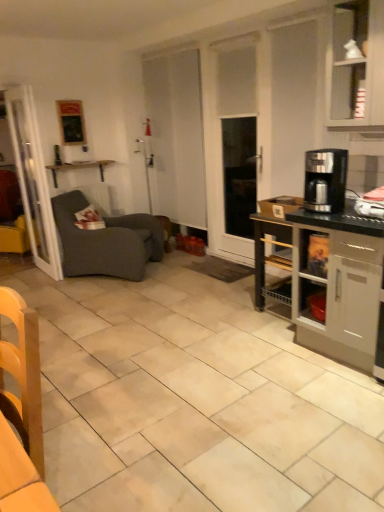
The image size is (384, 512). What do you see at coordinates (331, 282) in the screenshot?
I see `black glossy coffee maker at right` at bounding box center [331, 282].

Where is `white glossy cabinet at upper right`? This screenshot has height=512, width=384. white glossy cabinet at upper right is located at coordinates (356, 65).

What do you see at coordinates (325, 180) in the screenshot? This screenshot has width=384, height=512. I see `satin black coffee maker at right` at bounding box center [325, 180].

The width and height of the screenshot is (384, 512). I want to click on transparent glass door at left, so click(33, 180).

What is the approximate width of wooden chair at lower left?

wooden chair at lower left is 16.15 centimeters in width.

In order to face dark gray fabric studio couch at left, should I rotate leftwards or rightwards?

A 11.307 degree turn to the left will do.

This screenshot has width=384, height=512. In order to click on black glossy coffee maker at right in this screenshot , I will do `click(331, 282)`.

Does dark gray fabric studio couch at left contain wooden chair at lower left?

No, wooden chair at lower left is not inside dark gray fabric studio couch at left.

Is dark gray fabric studio couch at left turned away from wooden chair at lower left?

No, wooden chair at lower left is not at the back of dark gray fabric studio couch at left.

From a real-world perspective, which object stands above the other?

wooden chair at lower left.

From the image's perspective, is dark gray fabric studio couch at left below wooden chair at lower left?

Actually, dark gray fabric studio couch at left appears above wooden chair at lower left in the image.

Considering the sizes of white glossy cabinet at upper right and dark gray fabric studio couch at left in the image, is white glossy cabinet at upper right taller or shorter than dark gray fabric studio couch at left?

Clearly, white glossy cabinet at upper right is shorter compared to dark gray fabric studio couch at left.

Is white glossy cabinet at upper right facing away from dark gray fabric studio couch at left?

No, dark gray fabric studio couch at left is not at the back of white glossy cabinet at upper right.

How different are the orientations of white glossy cabinet at upper right and dark gray fabric studio couch at left in degrees?

The angular difference between white glossy cabinet at upper right and dark gray fabric studio couch at left is 126 degrees.

Considering the points (342, 62) and (139, 255), which point is behind, point (342, 62) or point (139, 255)?

The point (139, 255) is farther from the camera.

Which is more to the left, dark gray fabric studio couch at left or black glossy coffee maker at right?

From the viewer's perspective, dark gray fabric studio couch at left appears more on the left side.

Is dark gray fabric studio couch at left far away from black glossy coffee maker at right?

Yes, dark gray fabric studio couch at left and black glossy coffee maker at right are located far from each other.

How different are the orientations of dark gray fabric studio couch at left and black glossy coffee maker at right in degrees?

dark gray fabric studio couch at left and black glossy coffee maker at right are facing 127 degrees away from each other.

Is dark gray fabric studio couch at left aimed at black glossy coffee maker at right?

No, dark gray fabric studio couch at left is not facing towards black glossy coffee maker at right.

Which is less distant, (21, 115) or (365, 22)?

Point (21, 115).

Is transparent glass door at left inside or outside of white glossy cabinet at upper right?

transparent glass door at left is not enclosed by white glossy cabinet at upper right.

Is transparent glass door at left to the left or to the right of white glossy cabinet at upper right in the image?

transparent glass door at left is positioned on white glossy cabinet at upper right's left side.

Choose the correct answer: Is black glossy coffee maker at right inside transparent glass door at left or outside it?

black glossy coffee maker at right is not enclosed by transparent glass door at left.

At what (x,y) coordinates should I click in order to perform the action: click on glass door located above the black glossy coffee maker at right (from the image's perspective). Please return your answer as a coordinate pair (x, y). The width and height of the screenshot is (384, 512). Looking at the image, I should click on (33, 180).

Which of these two, black glossy coffee maker at right or transparent glass door at left, is bigger?

Bigger between the two is black glossy coffee maker at right.

Considering the relative sizes of wooden shelf at upper left and black glossy coffee maker at right in the image provided, is wooden shelf at upper left shorter than black glossy coffee maker at right?

Correct, wooden shelf at upper left is not as tall as black glossy coffee maker at right.

Between wooden shelf at upper left and black glossy coffee maker at right, which one appears on the right side from the viewer's perspective?

Positioned to the right is black glossy coffee maker at right.

Is wooden shelf at upper left looking in the opposite direction of black glossy coffee maker at right?

No.

Is wooden shelf at upper left bigger or smaller than black glossy coffee maker at right?

wooden shelf at upper left is smaller than black glossy coffee maker at right.

Could wooden shelf at upper left be considered to be inside black glossy coffee maker at right?

No.

Looking at this image, which object is closer to the camera, black glossy coffee maker at right or wooden shelf at upper left?

black glossy coffee maker at right is more forward.

From a real-world perspective, is black glossy coffee maker at right located higher than wooden shelf at upper left?

No, from a real-world perspective, black glossy coffee maker at right is not on top of wooden shelf at upper left.

The height and width of the screenshot is (512, 384). What are the coordinates of `chair below the dark gray fabric studio couch at left (from the image's perspective)` in the screenshot? It's located at click(x=22, y=414).

The height and width of the screenshot is (512, 384). Identify the location of studio couch beneath the white glossy cabinet at upper right (from a real-world perspective). (106, 241).

Considering their positions, is black glossy coffee maker at right positioned closer to white glossy cabinet at upper right than satin black coffee maker at right?

satin black coffee maker at right.

Estimate the real-world distances between objects in this image. Which object is closer to satin black coffee maker at right, wooden chair at lower left or wooden shelf at upper left?

The object closer to satin black coffee maker at right is wooden chair at lower left.

When comparing their distances from wooden chair at lower left, does dark gray fabric studio couch at left or transparent glass door at left seem closer?

dark gray fabric studio couch at left lies closer to wooden chair at lower left than the other object.

Looking at the image, which one is located closer to dark gray fabric studio couch at left, satin black coffee maker at right or transparent glass door at left?

transparent glass door at left lies closer to dark gray fabric studio couch at left than the other object.

From the image, which object appears to be farther from black glossy coffee maker at right, white glossy cabinet at upper right or transparent glass door at left?

transparent glass door at left.

Based on their spatial positions, is white glossy cabinet at upper right or black glossy coffee maker at right further from satin black coffee maker at right?

The object further to satin black coffee maker at right is white glossy cabinet at upper right.

Which object lies further to the anchor point transparent glass door at left, wooden chair at lower left or dark gray fabric studio couch at left?

wooden chair at lower left is further to transparent glass door at left.

Estimate the real-world distances between objects in this image. Which object is further from wooden chair at lower left, wooden shelf at upper left or black glossy coffee maker at right?

wooden shelf at upper left lies further to wooden chair at lower left than the other object.

Find the location of a particular element. Image resolution: width=384 pixels, height=512 pixels. coffee maker between dark gray fabric studio couch at left and white glossy cabinet at upper right in the horizontal direction is located at coordinates (325, 180).

At what (x,y) coordinates should I click in order to perform the action: click on cabinetry located between wooden chair at lower left and dark gray fabric studio couch at left in the depth direction. Please return your answer as a coordinate pair (x, y). Image resolution: width=384 pixels, height=512 pixels. Looking at the image, I should click on (356, 65).

Locate an element on the screen. coffee maker located between wooden chair at lower left and wooden shelf at upper left in the depth direction is located at coordinates (325, 180).

Image resolution: width=384 pixels, height=512 pixels. Identify the location of coffee maker between dark gray fabric studio couch at left and black glossy coffee maker at right in the horizontal direction. (x=325, y=180).